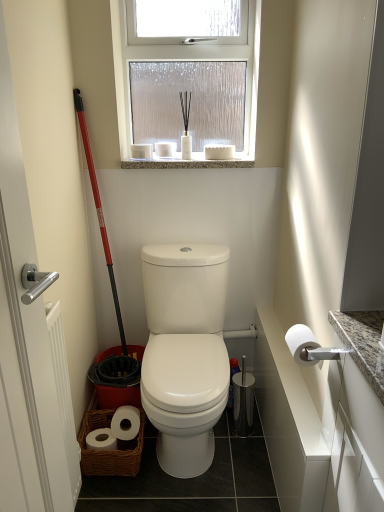
Question: Looking at the image, does frosted glass window at upper center seem bigger or smaller compared to white matte toilet paper at right?

Choices:
 (A) big
 (B) small

Answer: (A)

Question: Is frosted glass window at upper center taller or shorter than white matte toilet paper at right?

Choices:
 (A) short
 (B) tall

Answer: (B)

Question: Estimate the real-world distances between objects in this image. Which object is closer to the white glossy toilet at center?

Choices:
 (A) white matte toilet paper at right
 (B) frosted glass window at upper center

Answer: (A)

Question: Which object is the closest to the white matte toilet paper at right?

Choices:
 (A) frosted glass window at upper center
 (B) white glossy toilet at center

Answer: (B)